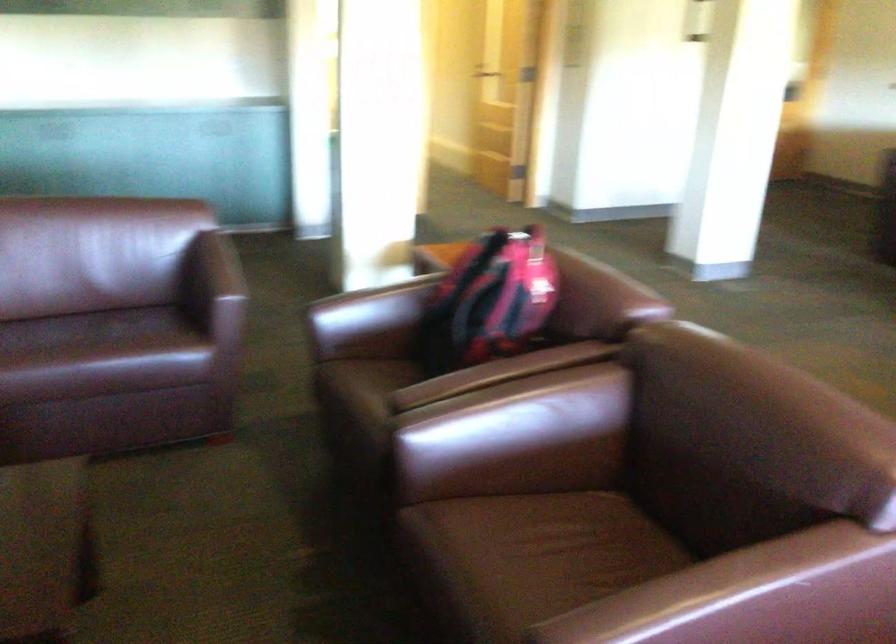
Which object does [488,301] point to?

It refers to a red and black backpack.